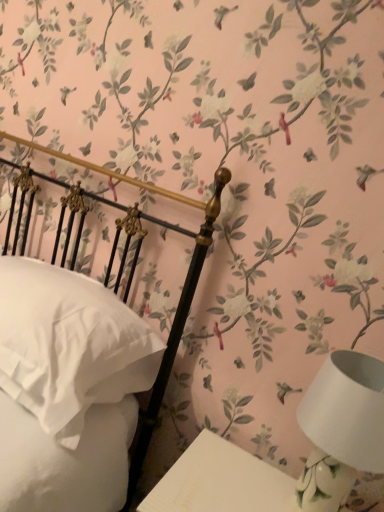
Question: From a real-world perspective, is white ceramic table lamp at lower right located beneath white glossy table at lower right?

Choices:
 (A) yes
 (B) no

Answer: (B)

Question: Does white ceramic table lamp at lower right lie in front of white glossy table at lower right?

Choices:
 (A) no
 (B) yes

Answer: (A)

Question: Is white ceramic table lamp at lower right looking in the opposite direction of white glossy table at lower right?

Choices:
 (A) yes
 (B) no

Answer: (B)

Question: Is white ceramic table lamp at lower right further to the viewer compared to white glossy table at lower right?

Choices:
 (A) no
 (B) yes

Answer: (B)

Question: Is white ceramic table lamp at lower right to the right of white glossy table at lower right from the viewer's perspective?

Choices:
 (A) no
 (B) yes

Answer: (B)

Question: Is white glossy table at lower right in front of or behind white ceramic table lamp at lower right in the image?

Choices:
 (A) front
 (B) behind

Answer: (A)

Question: From a real-world perspective, is white glossy table at lower right positioned above or below white ceramic table lamp at lower right?

Choices:
 (A) below
 (B) above

Answer: (A)

Question: Is white glossy table at lower right taller or shorter than white ceramic table lamp at lower right?

Choices:
 (A) short
 (B) tall

Answer: (A)

Question: Does point (276, 474) appear closer or farther from the camera than point (339, 495)?

Choices:
 (A) farther
 (B) closer

Answer: (A)

Question: From the image's perspective, is white soft pillow at left positioned above or below white glossy table at lower right?

Choices:
 (A) below
 (B) above

Answer: (B)

Question: In terms of height, does white soft pillow at left look taller or shorter compared to white glossy table at lower right?

Choices:
 (A) tall
 (B) short

Answer: (B)

Question: Is white soft pillow at left to the left or to the right of white glossy table at lower right in the image?

Choices:
 (A) right
 (B) left

Answer: (B)

Question: From a real-world perspective, relative to white glossy table at lower right, is white soft pillow at left vertically above or below?

Choices:
 (A) below
 (B) above

Answer: (B)

Question: Is white soft pillow at left taller or shorter than white ceramic table lamp at lower right?

Choices:
 (A) tall
 (B) short

Answer: (B)

Question: Would you say white soft pillow at left is to the left or to the right of white ceramic table lamp at lower right in the picture?

Choices:
 (A) right
 (B) left

Answer: (B)